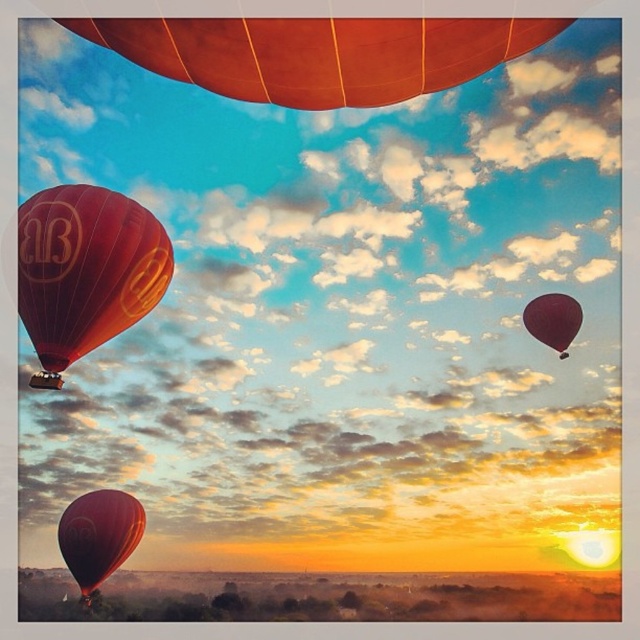
Based on the photo, you are a photographer trying to capture the matte orange balloon at upper center and the matte red hot air balloon at left in a single shot. Based on their heights, which balloon would appear closer to the top edge of your camera frame?

The matte red hot air balloon at left is taller than the matte orange balloon at upper center, so it would extend closer to the top edge of the camera frame.

You are a photographer trying to capture the matte orange balloon at upper center in your shot. The camera you are using has a rectangular viewfinder with coordinates from 0 to 1 on both axes. You want to center your shot at point (317, 52). Will the matte orange balloon at upper center be centered in your viewfinder?

Yes, the point (317, 52) corresponds to the matte orange balloon at upper center, so centering the viewfinder at that point will place the matte orange balloon at upper center in the center of the shot.

You are a photographer trying to capture the matte orange balloon at upper center and the matte red hot air balloon at left in a single shot. Which balloon should you focus on if you want to ensure the wider balloon is in the center of your photo?

The matte orange balloon at upper center has a greater width than the matte red hot air balloon at left, so you should focus on the matte orange balloon at upper center to center the wider balloon in your photo.